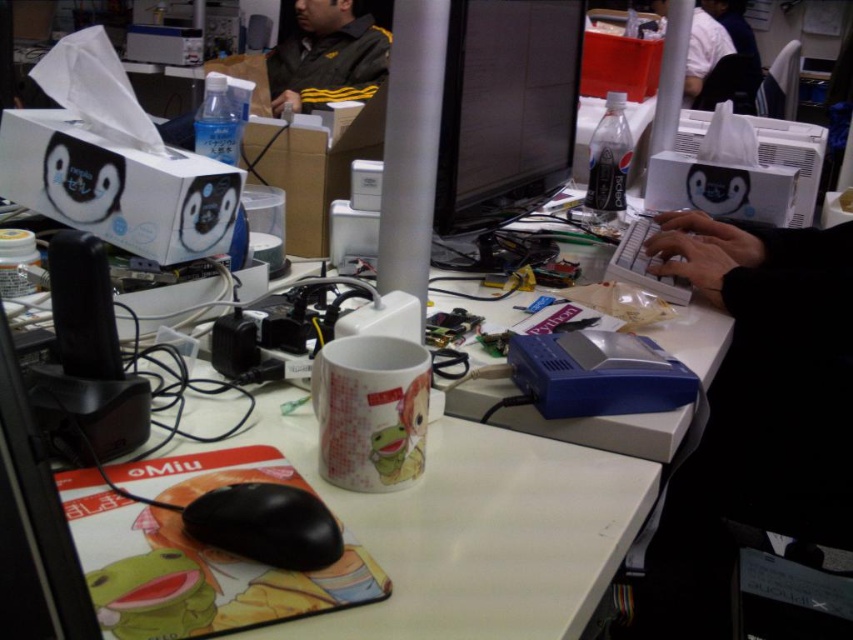
You are organizing the items on the desk and need to know the relative sizes of the objects. Which object is taller, the matte black monitor at center or the dark green jacket at upper center?

The dark green jacket at upper center is taller than the matte black monitor at center.

You are organizing a desk and need to place the dark green jacket at upper center and the black plastic mouse at lower left. Given their sizes, which object should you prioritize moving first to free up space?

The dark green jacket at upper center is larger in size than the black plastic mouse at lower left, so you should prioritize moving the dark green jacket at upper center first to free up more space.